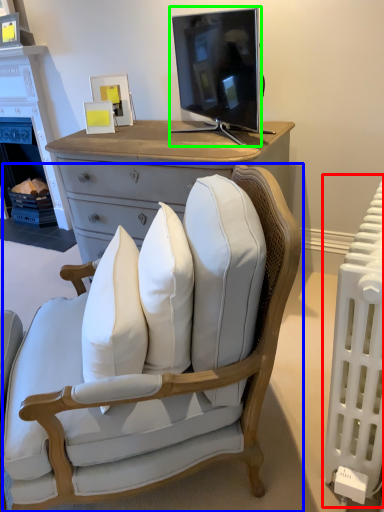
Question: Estimate the real-world distances between objects in this image. Which object is farther from radiator (highlighted by a red box), chair (highlighted by a blue box) or television (highlighted by a green box)?

Choices:
 (A) chair
 (B) television

Answer: (B)